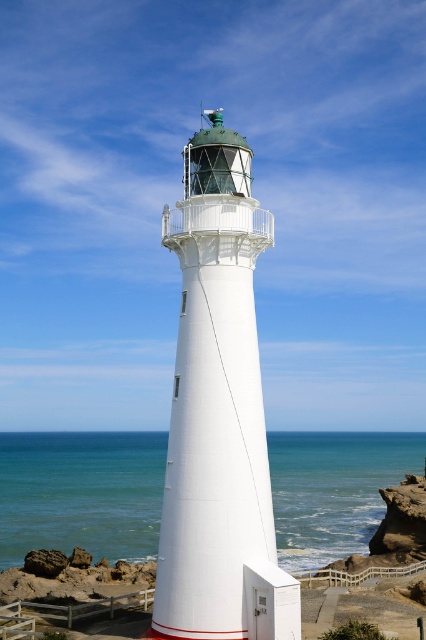
You are standing on the rocky coast and see the white smooth lighthouse at center and the blue water at center. Which object is nearer to you?

The white smooth lighthouse at center is closer to the viewer than the blue water at center.

You are standing at the base of the lighthouse and want to place two markers at the coordinates point (198, 433) and point (40, 531). Which marker will be closer to your current position?

Point (198, 433) is closer to the viewer than point (40, 531), so the marker at point (198, 433) will be closer to your current position.

You are a drone operator trying to capture a photo of the white smooth lighthouse at center and the blue water at center. From your current position, which object is higher in the image?

The white smooth lighthouse at center is above the blue water at center, so it is higher in the image.